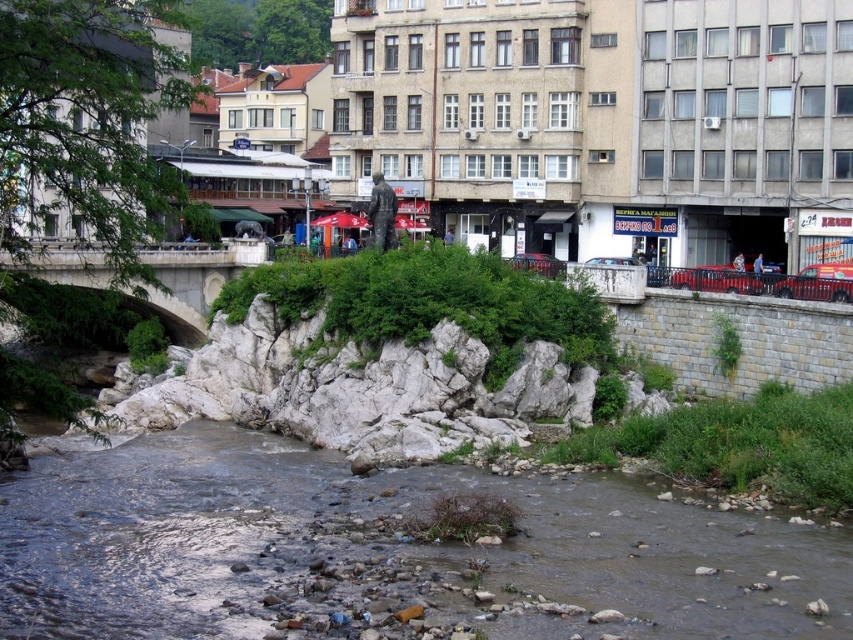
Consider the image. Is brown rocky riverbed at lower center taller than white stone bridge at left?

In fact, brown rocky riverbed at lower center may be shorter than white stone bridge at left.

Does brown rocky riverbed at lower center have a lesser height compared to white stone bridge at left?

Indeed, brown rocky riverbed at lower center has a lesser height compared to white stone bridge at left.

Does point (54, 600) lie in front of point (172, 275)?

Yes, point (54, 600) is closer to viewer.

The width and height of the screenshot is (853, 640). What are the coordinates of `brown rocky riverbed at lower center` in the screenshot? It's located at (386, 552).